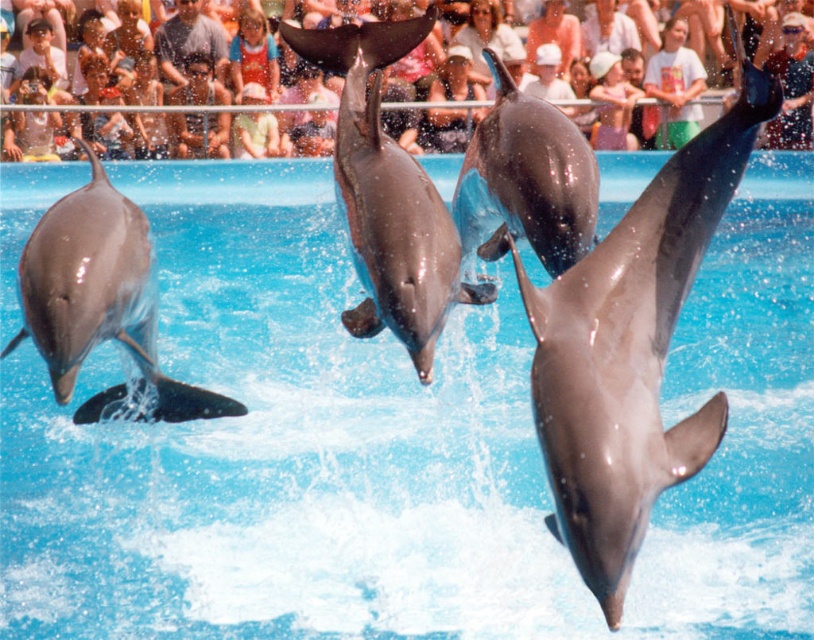
Which is above, smooth gray dolphin at left or smooth skin face at upper center?

smooth skin face at upper center is higher up.

How far apart are smooth gray dolphin at left and smooth skin face at upper center?

A distance of 9.15 meters exists between smooth gray dolphin at left and smooth skin face at upper center.

What are the coordinates of `smooth gray dolphin at left` in the screenshot? It's located at (101, 304).

Can you confirm if shiny gray dolphin at center is shorter than light blue denim jacket at upper center?

No, shiny gray dolphin at center is not shorter than light blue denim jacket at upper center.

The image size is (814, 640). I want to click on shiny gray dolphin at center, so click(632, 348).

Consider the image. Is glossy gray dolphin at center to the left of light blue denim jacket at upper center from the viewer's perspective?

In fact, glossy gray dolphin at center is to the right of light blue denim jacket at upper center.

Does glossy gray dolphin at center lie in front of light blue denim jacket at upper center?

Yes, it is.

Where is `glossy gray dolphin at center`? The height and width of the screenshot is (640, 814). glossy gray dolphin at center is located at coordinates (524, 180).